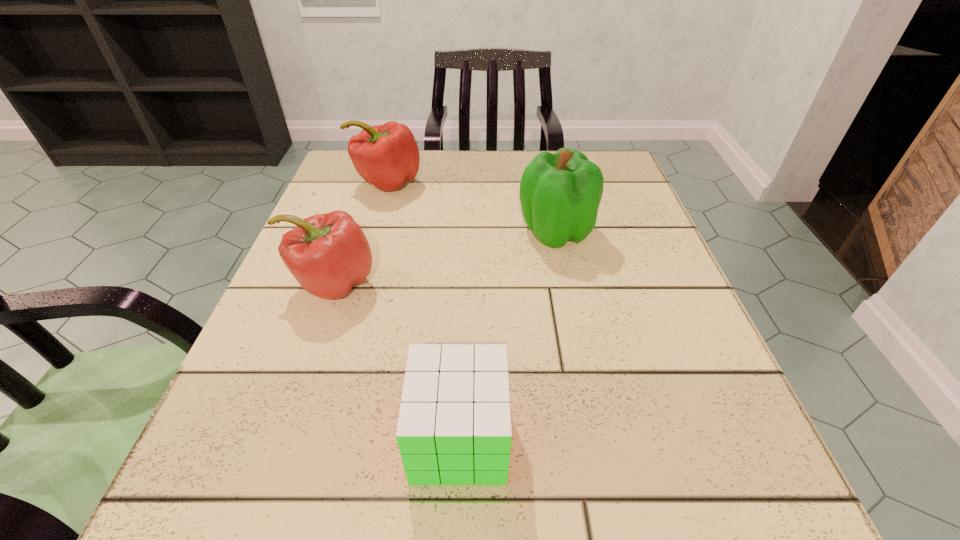
The image size is (960, 540). Identify the location of the tallest bell pepper. (560, 194).

The image size is (960, 540). I want to click on the rightmost object, so click(x=560, y=194).

I want to click on the farthest bell pepper, so click(386, 156).

At what (x,y) coordinates should I click in order to perform the action: click on the third farthest object. Please return your answer as a coordinate pair (x, y). Looking at the image, I should click on (328, 254).

Find the location of a particular element. This screenshot has width=960, height=540. the third object from left to right is located at coordinates (454, 427).

Find the location of `cube`. cube is located at coordinates (454, 427).

Locate an element on the screen. The width and height of the screenshot is (960, 540). free spot located 0.110m on the back of the tallest bell pepper is located at coordinates (545, 183).

Identify the location of vacant space situated on the right of the farthest bell pepper. The height and width of the screenshot is (540, 960). (461, 182).

Locate an element on the screen. The width and height of the screenshot is (960, 540). blank area located 0.160m on the front of the nearest bell pepper is located at coordinates (292, 400).

Where is `free spot located on the right of the second object from right to left`? This screenshot has height=540, width=960. free spot located on the right of the second object from right to left is located at coordinates (585, 438).